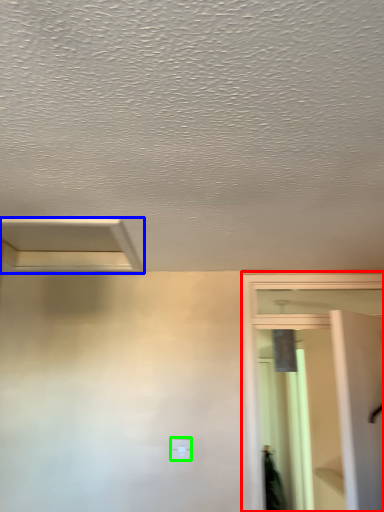
Question: Which is farther away from screen door (highlighted by a red box)? exhaust hood (highlighted by a blue box) or light switch (highlighted by a green box)?

Choices:
 (A) exhaust hood
 (B) light switch

Answer: (A)